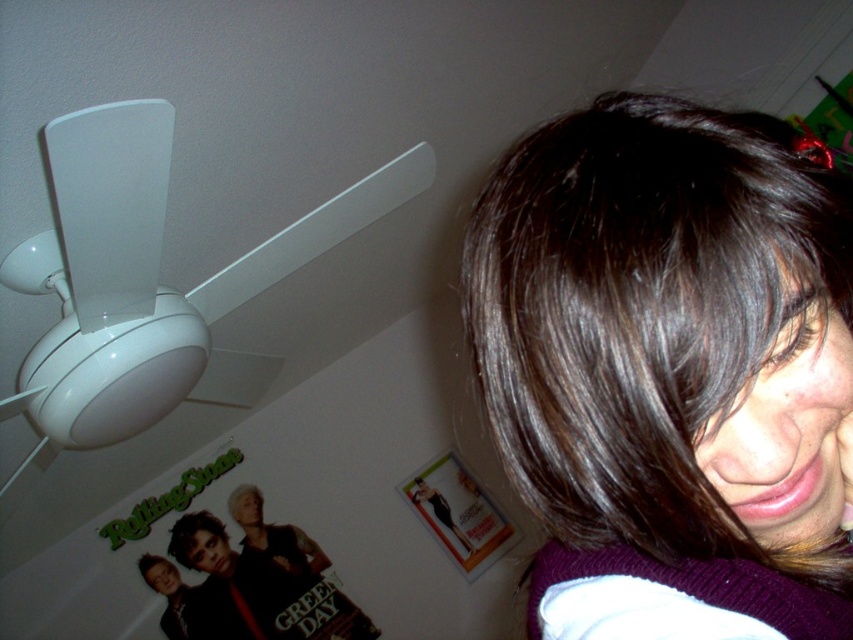
Is white matte ceiling fan at upper left above matte black band poster at upper left?

Correct, white matte ceiling fan at upper left is located above matte black band poster at upper left.

This screenshot has height=640, width=853. Describe the element at coordinates (146, 276) in the screenshot. I see `white matte ceiling fan at upper left` at that location.

This screenshot has width=853, height=640. Find the location of `white matte ceiling fan at upper left`. white matte ceiling fan at upper left is located at coordinates (146, 276).

Where is `white matte ceiling fan at upper left`? The width and height of the screenshot is (853, 640). white matte ceiling fan at upper left is located at coordinates (146, 276).

Between dark brown hair at upper right and matte black band poster at upper left, which one appears on the left side from the viewer's perspective?

matte black band poster at upper left is more to the left.

Is point (540, 368) more distant than point (254, 620)?

No, (540, 368) is in front of (254, 620).

The height and width of the screenshot is (640, 853). Find the location of `dark brown hair at upper right`. dark brown hair at upper right is located at coordinates (669, 372).

Can you confirm if dark brown hair at upper right is bigger than white matte ceiling fan at upper left?

Incorrect, dark brown hair at upper right is not larger than white matte ceiling fan at upper left.

Which is behind, point (583, 376) or point (258, 246)?

The point (258, 246) is behind.

This screenshot has width=853, height=640. What are the coordinates of `dark brown hair at upper right` in the screenshot? It's located at (669, 372).